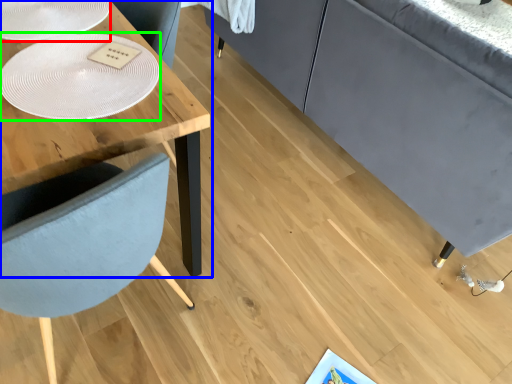
Question: Based on their relative distances, which object is nearer to glass plate (highlighted by a red box)? Choose from table (highlighted by a blue box) and glass plate (highlighted by a green box).

Choices:
 (A) table
 (B) glass plate

Answer: (A)